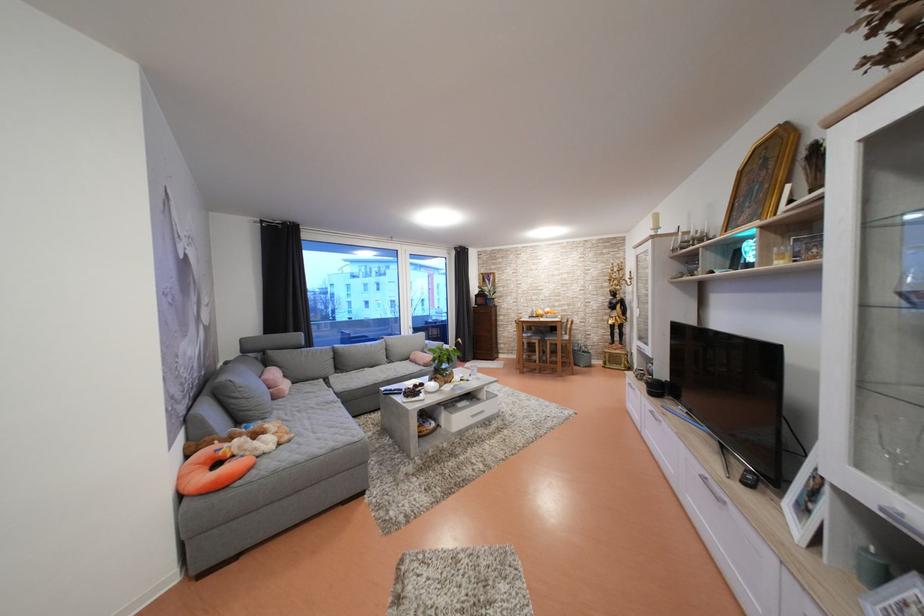
Locate an element on the screen. The height and width of the screenshot is (616, 924). silver cabinet handle is located at coordinates (711, 488).